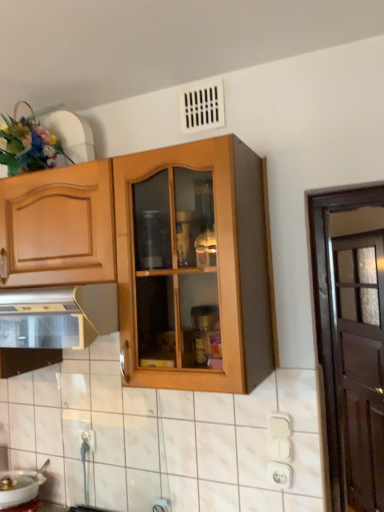
Where is `white plastic electric outlet at lower center, the second electric outlet from the right`? This screenshot has width=384, height=512. white plastic electric outlet at lower center, the second electric outlet from the right is located at coordinates (88, 440).

In order to face white plastic electric outlet at lower right, which ranks as the first electric outlet in front-to-back order, should I rotate leftwards or rightwards?

You should rotate right by 11.589 degrees.

The width and height of the screenshot is (384, 512). I want to click on white glossy sink at lower left, so click(x=20, y=486).

Describe the element at coordinates (58, 316) in the screenshot. The height and width of the screenshot is (512, 384). I see `metallic stainless steel oven at lower left` at that location.

You are a GUI agent. You are given a task and a screenshot of the screen. Output one action in this format:
    pyautogui.click(x=<x>, y=<y>)
    Task: Click on the white plastic electric outlet at lower center, the first electric outlet in the left-to-right sequence
    
    Given the screenshot: What is the action you would take?
    pyautogui.click(x=88, y=440)

Considering the relative sizes of brown wooden door at right and metallic stainless steel oven at lower left in the image provided, is brown wooden door at right shorter than metallic stainless steel oven at lower left?

No.

The height and width of the screenshot is (512, 384). Identify the location of door behind the metallic stainless steel oven at lower left. (331, 311).

Visually, is brown wooden door at right positioned to the left or to the right of metallic stainless steel oven at lower left?

Clearly, brown wooden door at right is on the right of metallic stainless steel oven at lower left in the image.

Does brown wooden door at right have a smaller size compared to metallic stainless steel oven at lower left?

Yes.

Looking at this image, considering the sizes of metallic stainless steel oven at lower left and brown wooden door at right in the image, is metallic stainless steel oven at lower left taller or shorter than brown wooden door at right?

Clearly, metallic stainless steel oven at lower left is shorter compared to brown wooden door at right.

From a real-world perspective, is metallic stainless steel oven at lower left positioned under brown wooden door at right based on gravity?

No, from a real-world perspective, metallic stainless steel oven at lower left is not under brown wooden door at right.

From the image's perspective, which one is positioned higher, metallic stainless steel oven at lower left or brown wooden door at right?

metallic stainless steel oven at lower left.

Would you consider metallic stainless steel oven at lower left to be distant from brown wooden door at right?

No, there isn't a large distance between metallic stainless steel oven at lower left and brown wooden door at right.

From the picture: From a real-world perspective, which is physically above, metallic stainless steel oven at lower left or white plastic electric outlet at lower center, the second electric outlet from the right?

From a 3D spatial view, metallic stainless steel oven at lower left is above.

Are metallic stainless steel oven at lower left and white plastic electric outlet at lower center, the first electric outlet from the back, making contact?

There is a gap between metallic stainless steel oven at lower left and white plastic electric outlet at lower center, the first electric outlet from the back.

Is metallic stainless steel oven at lower left positioned with its back to white plastic electric outlet at lower center, the first electric outlet from the back?

No, metallic stainless steel oven at lower left's orientation is not away from white plastic electric outlet at lower center, the first electric outlet from the back.

Where is `kitchen appliance above the white plastic electric outlet at lower center, the first electric outlet in the left-to-right sequence (from a real-world perspective)`? kitchen appliance above the white plastic electric outlet at lower center, the first electric outlet in the left-to-right sequence (from a real-world perspective) is located at coordinates (58, 316).

Which of these two, metallic stainless steel oven at lower left or white glossy sink at lower left, is wider?

With larger width is metallic stainless steel oven at lower left.

Is metallic stainless steel oven at lower left closer to camera compared to white glossy sink at lower left?

Yes.

From a real-world perspective, between metallic stainless steel oven at lower left and white glossy sink at lower left, who is vertically lower?

In real-world perspective, white glossy sink at lower left is lower.

Who is smaller, white plastic electric outlet at lower right, which ranks as the first electric outlet in right-to-left order, or fluffy floral bouquet at upper left?

white plastic electric outlet at lower right, which ranks as the first electric outlet in right-to-left order.

How different are the orientations of white plastic electric outlet at lower right, which ranks as the first electric outlet in right-to-left order, and fluffy floral bouquet at upper left in degrees?

The angle between the facing direction of white plastic electric outlet at lower right, which ranks as the first electric outlet in right-to-left order, and the facing direction of fluffy floral bouquet at upper left is 3.28 degrees.

Locate an element on the screen. flower located on the left of white plastic electric outlet at lower right, which ranks as the first electric outlet in front-to-back order is located at coordinates (29, 143).

Considering the relative sizes of white plastic electric outlet at lower right, marked as the second electric outlet in a left-to-right arrangement, and fluffy floral bouquet at upper left in the image provided, is white plastic electric outlet at lower right, marked as the second electric outlet in a left-to-right arrangement, thinner than fluffy floral bouquet at upper left?

Yes.

From a real-world perspective, is white plastic electric outlet at lower right, marked as the second electric outlet in a left-to-right arrangement, physically located above or below white glossy sink at lower left?

white plastic electric outlet at lower right, marked as the second electric outlet in a left-to-right arrangement, is above white glossy sink at lower left.

Considering the relative positions of white plastic electric outlet at lower right, marked as the second electric outlet in a left-to-right arrangement, and white glossy sink at lower left in the image provided, is white plastic electric outlet at lower right, marked as the second electric outlet in a left-to-right arrangement, to the right of white glossy sink at lower left from the viewer's perspective?

Correct, you'll find white plastic electric outlet at lower right, marked as the second electric outlet in a left-to-right arrangement, to the right of white glossy sink at lower left.

From the image's perspective, is white plastic electric outlet at lower right, which ranks as the first electric outlet in right-to-left order, on white glossy sink at lower left?

Yes, from the image's perspective, white plastic electric outlet at lower right, which ranks as the first electric outlet in right-to-left order, is above white glossy sink at lower left.

How different are the orientations of white plastic electric outlet at lower right, which ranks as the first electric outlet in front-to-back order, and white glossy sink at lower left in degrees?

3.28 degrees.

From the image's perspective, is fluffy floral bouquet at upper left beneath white plastic electric outlet at lower right, which ranks as the first electric outlet in front-to-back order?

Incorrect, from the image's perspective, fluffy floral bouquet at upper left is higher than white plastic electric outlet at lower right, which ranks as the first electric outlet in front-to-back order.

Can you confirm if fluffy floral bouquet at upper left is bigger than white plastic electric outlet at lower right, the second electric outlet in the back-to-front sequence?

Indeed, fluffy floral bouquet at upper left has a larger size compared to white plastic electric outlet at lower right, the second electric outlet in the back-to-front sequence.

Is the depth of fluffy floral bouquet at upper left less than that of white plastic electric outlet at lower right, which ranks as the first electric outlet in front-to-back order?

Yes, the depth of fluffy floral bouquet at upper left is less than that of white plastic electric outlet at lower right, which ranks as the first electric outlet in front-to-back order.

Is fluffy floral bouquet at upper left oriented away from white plastic electric outlet at lower right, marked as the second electric outlet in a left-to-right arrangement?

No, fluffy floral bouquet at upper left is not facing away from white plastic electric outlet at lower right, marked as the second electric outlet in a left-to-right arrangement.

Identify the location of door located below the metallic stainless steel oven at lower left (from the image's perspective). The height and width of the screenshot is (512, 384). (331, 311).

The image size is (384, 512). In order to click on door behind the metallic stainless steel oven at lower left in this screenshot , I will do `click(331, 311)`.

In the scene shown: Considering their positions, is white plastic electric outlet at lower center, the first electric outlet from the back, positioned closer to fluffy floral bouquet at upper left than brown wooden door at right?

Among the two, brown wooden door at right is located nearer to fluffy floral bouquet at upper left.

From the image, which object appears to be farther from white plastic electric outlet at lower center, the second electric outlet when ordered from front to back, white plastic electric outlet at lower right, marked as the second electric outlet in a left-to-right arrangement, or brown wooden door at right?

Among the two, brown wooden door at right is located further to white plastic electric outlet at lower center, the second electric outlet when ordered from front to back.

From the image, which object appears to be farther from fluffy floral bouquet at upper left, brown wooden door at right or white glossy sink at lower left?

Based on the image, white glossy sink at lower left appears to be further to fluffy floral bouquet at upper left.

Consider the image. Considering their positions, is white glossy sink at lower left positioned closer to brown wooden door at right than white plastic electric outlet at lower center, the first electric outlet from the back?

white plastic electric outlet at lower center, the first electric outlet from the back, lies closer to brown wooden door at right than the other object.

Considering their positions, is fluffy floral bouquet at upper left positioned closer to white plastic electric outlet at lower center, the first electric outlet from the back, than brown wooden door at right?

Among the two, brown wooden door at right is located nearer to white plastic electric outlet at lower center, the first electric outlet from the back.

When comparing their distances from white plastic electric outlet at lower right, which ranks as the first electric outlet in right-to-left order, does metallic stainless steel oven at lower left or white plastic electric outlet at lower center, the second electric outlet from the right, seem further?

metallic stainless steel oven at lower left.

In the scene shown: Estimate the real-world distances between objects in this image. Which object is further from white plastic electric outlet at lower center, the first electric outlet from the back, brown wooden door at right or white glossy sink at lower left?

brown wooden door at right is positioned further to the anchor white plastic electric outlet at lower center, the first electric outlet from the back.

Based on their spatial positions, is white glossy sink at lower left or fluffy floral bouquet at upper left closer to white plastic electric outlet at lower center, the second electric outlet from the right?

white glossy sink at lower left lies closer to white plastic electric outlet at lower center, the second electric outlet from the right, than the other object.

Image resolution: width=384 pixels, height=512 pixels. In order to click on electric outlet situated between white glossy sink at lower left and white plastic electric outlet at lower right, which ranks as the first electric outlet in right-to-left order, from left to right in this screenshot , I will do `click(88, 440)`.

You are a GUI agent. You are given a task and a screenshot of the screen. Output one action in this format:
    pyautogui.click(x=<x>, y=<y>)
    Task: Click on the kitchen appliance between fluffy floral bouquet at upper left and brown wooden door at right
    The width and height of the screenshot is (384, 512).
    Given the screenshot: What is the action you would take?
    pyautogui.click(x=58, y=316)

Locate an element on the screen. The height and width of the screenshot is (512, 384). electric outlet between fluffy floral bouquet at upper left and white plastic electric outlet at lower center, the second electric outlet when ordered from front to back, from top to bottom is located at coordinates (280, 475).

This screenshot has width=384, height=512. I want to click on electric outlet between metallic stainless steel oven at lower left and white plastic electric outlet at lower right, marked as the second electric outlet in a left-to-right arrangement, in the horizontal direction, so click(x=88, y=440).